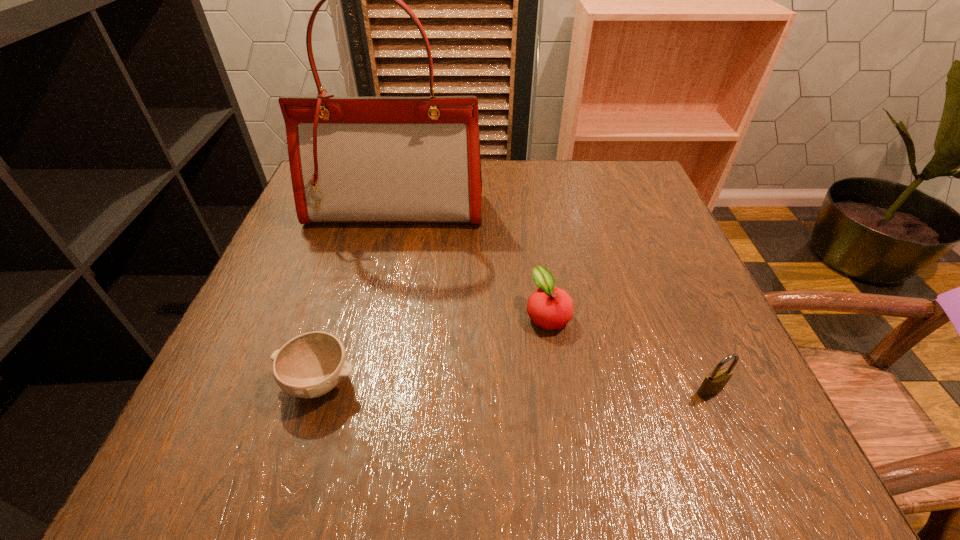
Select which object appears as the closest to the farthest object. Please provide its 2D coordinates. Your answer should be formatted as a tuple, i.e. [(x, y)], where the tuple contains the x and y coordinates of a point satisfying the conditions above.

[(549, 307)]

Where is `free space that satisfies the following two spatial constraints: 1. on the front side of the rightmost object; 2. on the left side of the farthest object`? Image resolution: width=960 pixels, height=540 pixels. free space that satisfies the following two spatial constraints: 1. on the front side of the rightmost object; 2. on the left side of the farthest object is located at coordinates (354, 391).